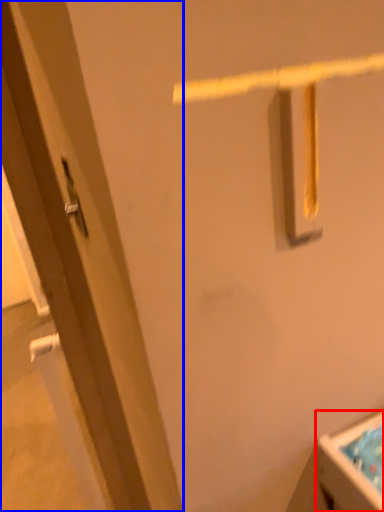
Question: Which object is closer to the camera taking this photo, sink (highlighted by a red box) or door (highlighted by a blue box)?

Choices:
 (A) sink
 (B) door

Answer: (B)